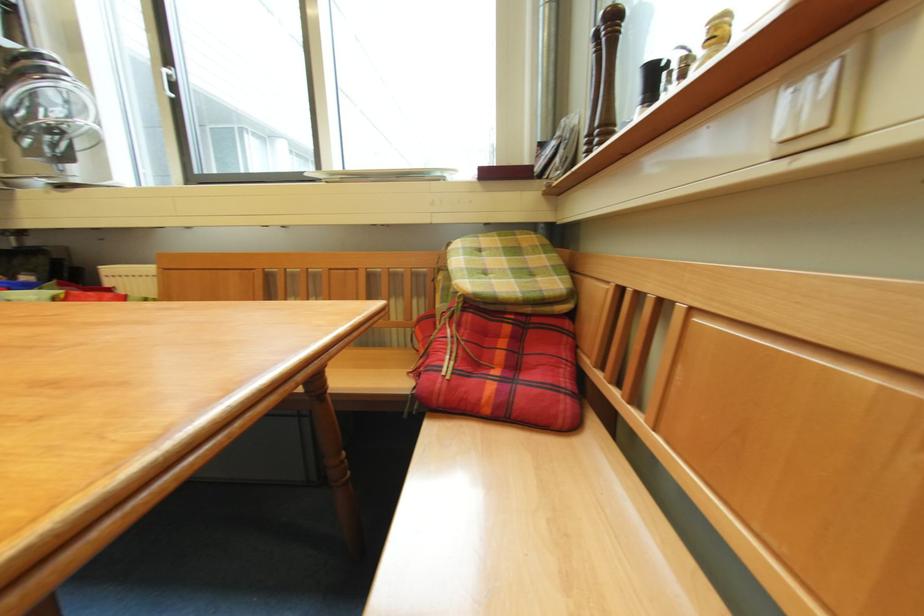
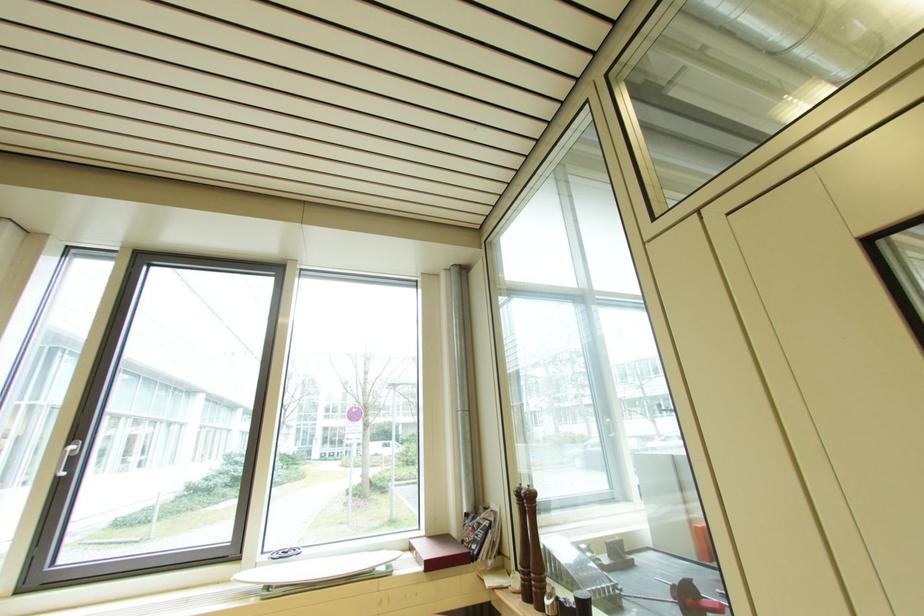
Find the pixel in the second image that matches pixel 171 75 in the first image.

(73, 455)